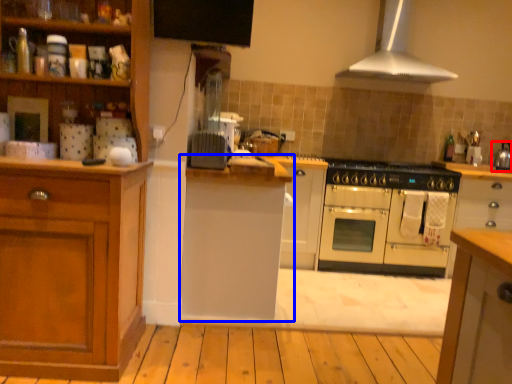
Question: Which point is closer to the camera, kitchen appliance (highlighted by a red box) or cabinetry (highlighted by a blue box)?

Choices:
 (A) kitchen appliance
 (B) cabinetry

Answer: (B)